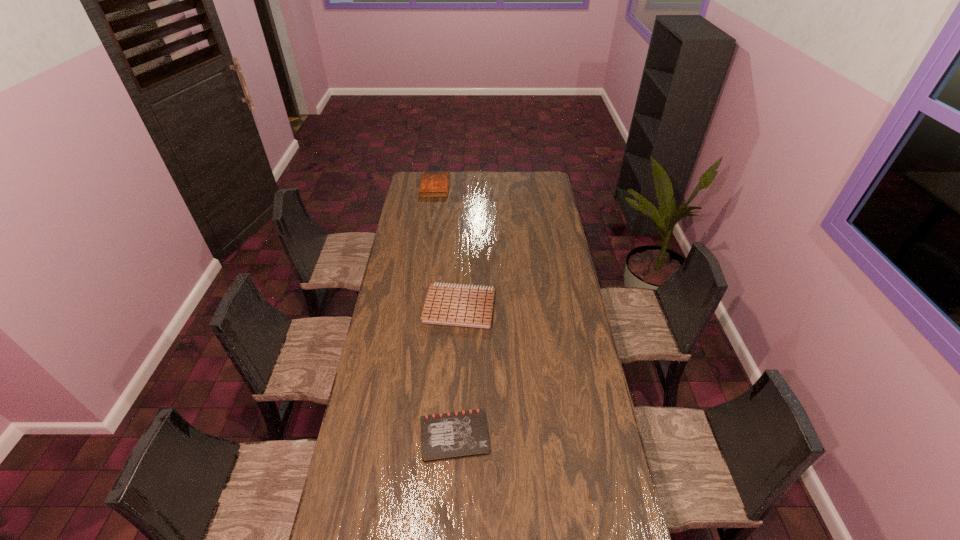
I want to click on object present at the left edge, so click(433, 184).

Locate an element on the screen. The width and height of the screenshot is (960, 540). object at the far left corner is located at coordinates (433, 184).

Image resolution: width=960 pixels, height=540 pixels. In the image, there is a desktop. What are the coordinates of `vacant area at the far edge` in the screenshot? It's located at (469, 178).

Image resolution: width=960 pixels, height=540 pixels. In order to click on vacant space at the left edge of the desktop in this screenshot , I will do `click(352, 461)`.

I want to click on free space at the right edge of the desktop, so click(x=563, y=333).

At what (x,y) coordinates should I click in order to perform the action: click on free space at the far left corner of the desktop. Please return your answer as a coordinate pair (x, y). This screenshot has width=960, height=540. Looking at the image, I should click on (413, 176).

Where is `vacant point located between the nearest object and the second nearest object`? vacant point located between the nearest object and the second nearest object is located at coordinates (457, 371).

The height and width of the screenshot is (540, 960). I want to click on unoccupied area between the tallest object and the second farthest object, so click(447, 247).

Identify the location of empty space that is in between the second shortest object and the farthest object. Image resolution: width=960 pixels, height=540 pixels. (447, 247).

Locate an element on the screen. Image resolution: width=960 pixels, height=540 pixels. free space that is in between the second nearest object and the nearer notebook is located at coordinates (457, 371).